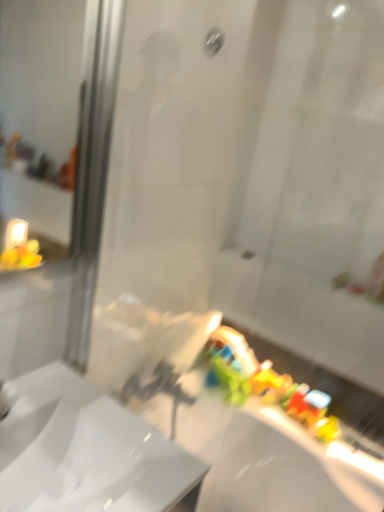
Question: From a real-world perspective, is matte silver shower at upper center physically located above or below white glossy sink at center?

Choices:
 (A) below
 (B) above

Answer: (B)

Question: In terms of height, does matte silver shower at upper center look taller or shorter compared to white glossy sink at center?

Choices:
 (A) tall
 (B) short

Answer: (B)

Question: Estimate the real-world distances between objects in this image. Which object is farther from the matte silver shower at upper center?

Choices:
 (A) white glossy sink at center
 (B) white glossy bath at lower right

Answer: (B)

Question: Based on their relative distances, which object is nearer to the matte silver shower at upper center?

Choices:
 (A) white glossy bath at lower right
 (B) white glossy sink at center

Answer: (B)